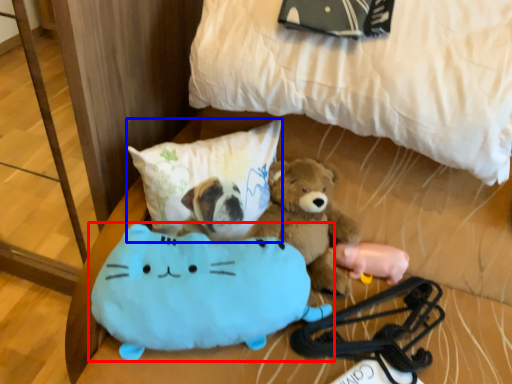
Question: Among these objects, which one is farthest to the camera, toy (highlighted by a red box) or pillow (highlighted by a blue box)?

Choices:
 (A) toy
 (B) pillow

Answer: (B)